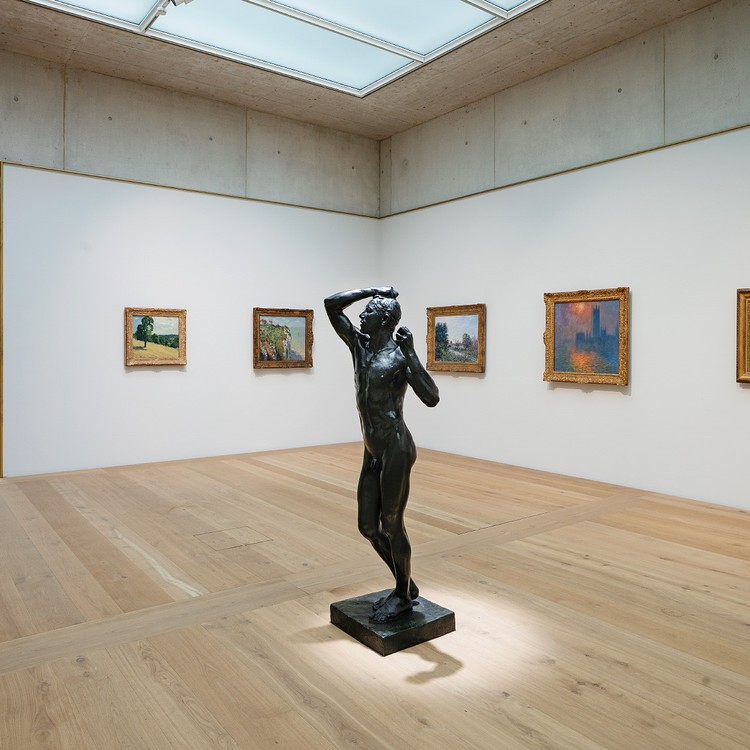
Locate an element on the screen. skylights is located at coordinates (238, 10).